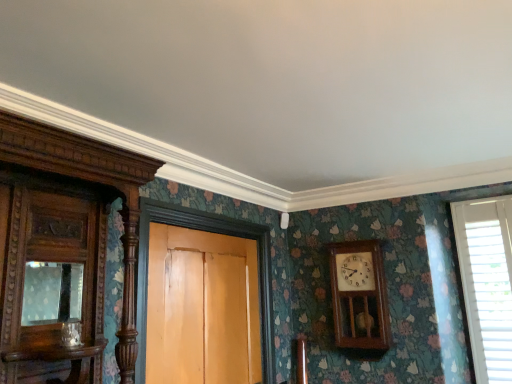
The width and height of the screenshot is (512, 384). In order to click on matte glass mirror at left in this screenshot , I will do (x=52, y=293).

Is white plastic blinds at right outside of wooden wall clock at center-right?

Indeed, white plastic blinds at right is completely outside wooden wall clock at center-right.

Considering the relative sizes of white plastic blinds at right and wooden wall clock at center-right in the image provided, is white plastic blinds at right shorter than wooden wall clock at center-right?

Incorrect, the height of white plastic blinds at right does not fall short of that of wooden wall clock at center-right.

From a real-world perspective, which object stands above the other?

From a 3D spatial view, white plastic blinds at right is above.

From the image's perspective, does white plastic blinds at right appear higher than wooden door at center?

Indeed, from the image's perspective, white plastic blinds at right is shown above wooden door at center.

Do you think white plastic blinds at right is within wooden door at center, or outside of it?

white plastic blinds at right is spatially situated outside wooden door at center.

How far apart are white plastic blinds at right and wooden door at center?

1.42 meters.

From a real-world perspective, relative to wooden wall clock at center-right, is matte glass mirror at left vertically above or below?

matte glass mirror at left is above wooden wall clock at center-right.

Is matte glass mirror at left taller than wooden wall clock at center-right?

In fact, matte glass mirror at left may be shorter than wooden wall clock at center-right.

How different are the orientations of matte glass mirror at left and wooden wall clock at center-right in degrees?

The angle between the facing direction of matte glass mirror at left and the facing direction of wooden wall clock at center-right is 87.2 degrees.

Considering the relative positions of matte glass mirror at left and white plastic blinds at right in the image provided, is matte glass mirror at left to the right of white plastic blinds at right from the viewer's perspective?

In fact, matte glass mirror at left is to the left of white plastic blinds at right.

From the image's perspective, is matte glass mirror at left positioned above or below white plastic blinds at right?

matte glass mirror at left is situated higher than white plastic blinds at right in the image.

Is matte glass mirror at left directly adjacent to white plastic blinds at right?

No, matte glass mirror at left is not making contact with white plastic blinds at right.

Which is further, (128, 209) or (502, 206)?

The point (502, 206) is behind.

From a real-world perspective, is polished wood cabinet at left located higher than white plastic blinds at right?

Yes, from a real-world perspective, polished wood cabinet at left is over white plastic blinds at right

Are polished wood cabinet at left and white plastic blinds at right making contact?

No, polished wood cabinet at left is not in contact with white plastic blinds at right.

Considering the relative positions of polished wood cabinet at left and white plastic blinds at right in the image provided, is polished wood cabinet at left to the left or to the right of white plastic blinds at right?

Based on their positions, polished wood cabinet at left is located to the left of white plastic blinds at right.

Between wooden door at center and white plastic blinds at right, which one has larger width?

wooden door at center is wider.

Considering the sizes of objects wooden door at center and white plastic blinds at right in the image provided, who is taller, wooden door at center or white plastic blinds at right?

white plastic blinds at right.

Would you say wooden door at center is a long distance from white plastic blinds at right?

wooden door at center is positioned a significant distance from white plastic blinds at right.

Based on the photo, is wooden door at center turned away from white plastic blinds at right?

No, wooden door at center is not facing away from white plastic blinds at right.

Do you think white plastic blinds at right is within matte glass mirror at left, or outside of it?

The correct answer is: outside.

Is white plastic blinds at right far away from matte glass mirror at left?

Yes, white plastic blinds at right is far from matte glass mirror at left.

Based on the photo, relative to matte glass mirror at left, is white plastic blinds at right in front or behind?

white plastic blinds at right is positioned farther from the viewer than matte glass mirror at left.

Is white plastic blinds at right oriented towards matte glass mirror at left?

No.

What are the coordinates of `window above the wooden wall clock at center-right (from the image's perspective)` in the screenshot? It's located at (486, 282).

Find the location of `door that appears on the left of white plastic blinds at right`. door that appears on the left of white plastic blinds at right is located at coordinates (205, 309).

Based on their spatial positions, is polished wood cabinet at left or wooden wall clock at center-right closer to matte glass mirror at left?

polished wood cabinet at left lies closer to matte glass mirror at left than the other object.

Which object lies further to the anchor point polished wood cabinet at left, white plastic blinds at right or wooden door at center?

Among the two, white plastic blinds at right is located further to polished wood cabinet at left.

Which object lies further to the anchor point polished wood cabinet at left, wooden wall clock at center-right or matte glass mirror at left?

Based on the image, wooden wall clock at center-right appears to be further to polished wood cabinet at left.

Which object lies nearer to the anchor point polished wood cabinet at left, wooden wall clock at center-right or white plastic blinds at right?

wooden wall clock at center-right is positioned closer to the anchor polished wood cabinet at left.

Which object lies nearer to the anchor point polished wood cabinet at left, wooden door at center or wooden wall clock at center-right?

Among the two, wooden door at center is located nearer to polished wood cabinet at left.

Based on the photo, looking at the image, which one is located further to wooden door at center, polished wood cabinet at left or wooden wall clock at center-right?

Based on the image, wooden wall clock at center-right appears to be further to wooden door at center.

Looking at the image, which one is located closer to matte glass mirror at left, white plastic blinds at right or wooden door at center?

Among the two, wooden door at center is located nearer to matte glass mirror at left.

Looking at the image, which one is located closer to white plastic blinds at right, wooden wall clock at center-right or matte glass mirror at left?

wooden wall clock at center-right.

Locate an element on the screen. door located between polished wood cabinet at left and white plastic blinds at right in the left-right direction is located at coordinates (205, 309).

In order to click on mirror between polished wood cabinet at left and wooden door at center along the z-axis in this screenshot , I will do `click(52, 293)`.

Identify the location of wall clock between matte glass mirror at left and white plastic blinds at right from left to right. [359, 296].

The height and width of the screenshot is (384, 512). I want to click on cabinetry between matte glass mirror at left and wooden wall clock at center-right, so click(62, 250).